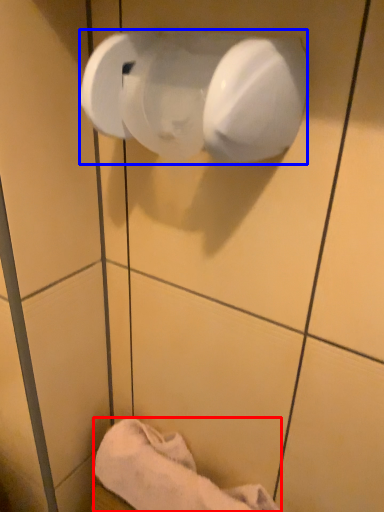
Question: Which object is further to the camera taking this photo, towel (highlighted by a red box) or toilet paper (highlighted by a blue box)?

Choices:
 (A) towel
 (B) toilet paper

Answer: (A)